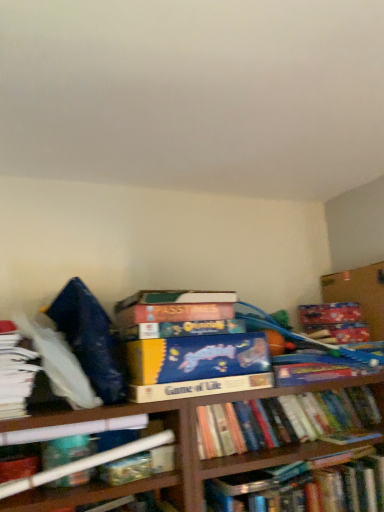
Question: Are white paper at left, which is counted as the 1th book, starting from the top, and cardboard box at upper right located far from each other?

Choices:
 (A) no
 (B) yes

Answer: (B)

Question: Is white paper at left, which is counted as the 1th book, starting from the top, positioned before cardboard box at upper right?

Choices:
 (A) no
 (B) yes

Answer: (B)

Question: Does white paper at left, which is counted as the 1th book, starting from the top, contain cardboard box at upper right?

Choices:
 (A) no
 (B) yes

Answer: (A)

Question: Is white paper at left, positioned as the 4th book in bottom-to-top order, at the left side of cardboard box at upper right?

Choices:
 (A) no
 (B) yes

Answer: (B)

Question: From the image's perspective, does white paper at left, which is counted as the 1th book, starting from the top, appear higher than cardboard box at upper right?

Choices:
 (A) yes
 (B) no

Answer: (B)

Question: Relative to hardcover book at center, the first book positioned from the bottom, is cardboard box at upper right in front or behind?

Choices:
 (A) front
 (B) behind

Answer: (B)

Question: From the image's perspective, is cardboard box at upper right above or below hardcover book at center, placed as the 4th book when sorted from top to bottom?

Choices:
 (A) below
 (B) above

Answer: (B)

Question: In terms of size, does cardboard box at upper right appear bigger or smaller than hardcover book at center, the first book positioned from the bottom?

Choices:
 (A) small
 (B) big

Answer: (A)

Question: From a real-world perspective, is cardboard box at upper right above or below hardcover book at center, the first book positioned from the bottom?

Choices:
 (A) below
 (B) above

Answer: (B)

Question: In terms of width, does hardcover book at center, placed as the 4th book when sorted from top to bottom, look wider or thinner when compared to hardcover book at center, the second book from the bottom?

Choices:
 (A) thin
 (B) wide

Answer: (B)

Question: Is hardcover book at center, the first book positioned from the bottom, to the left or to the right of hardcover book at center, the second book from the bottom, in the image?

Choices:
 (A) right
 (B) left

Answer: (A)

Question: Considering the positions of hardcover book at center, the first book positioned from the bottom, and hardcover book at center, the second book from the bottom, in the image, is hardcover book at center, the first book positioned from the bottom, bigger or smaller than hardcover book at center, the second book from the bottom,?

Choices:
 (A) small
 (B) big

Answer: (B)

Question: From their relative heights in the image, would you say hardcover book at center, the first book positioned from the bottom, is taller or shorter than hardcover book at center, acting as the 3th book starting from the top?

Choices:
 (A) tall
 (B) short

Answer: (A)

Question: From a real-world perspective, is hardcover book at center, the second book from the bottom, above or below hardcover book at lower left, which is the second book from top to bottom?

Choices:
 (A) above
 (B) below

Answer: (B)

Question: Considering the positions of hardcover book at center, the second book from the bottom, and hardcover book at lower left, the 3th book from the bottom, in the image, is hardcover book at center, the second book from the bottom, wider or thinner than hardcover book at lower left, the 3th book from the bottom,?

Choices:
 (A) wide
 (B) thin

Answer: (A)